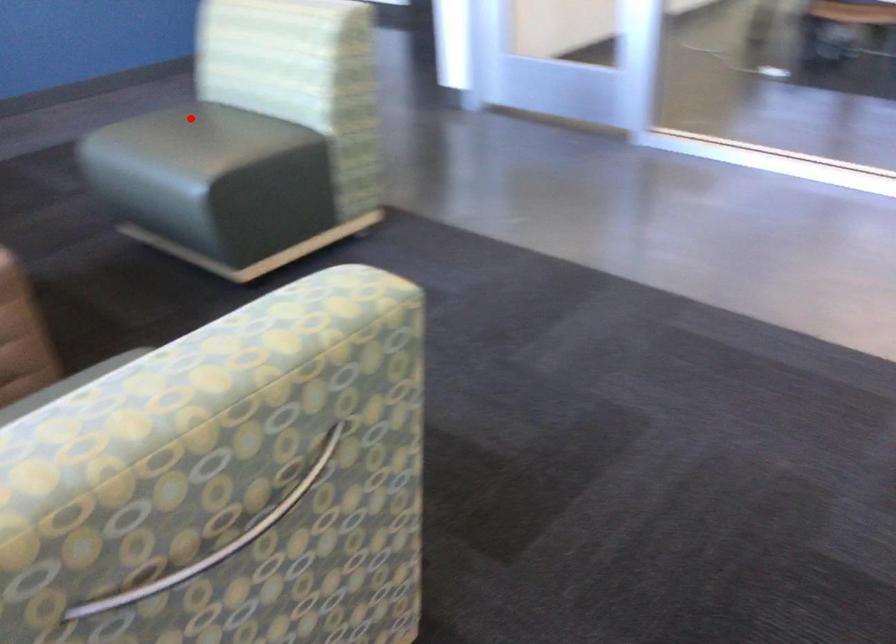
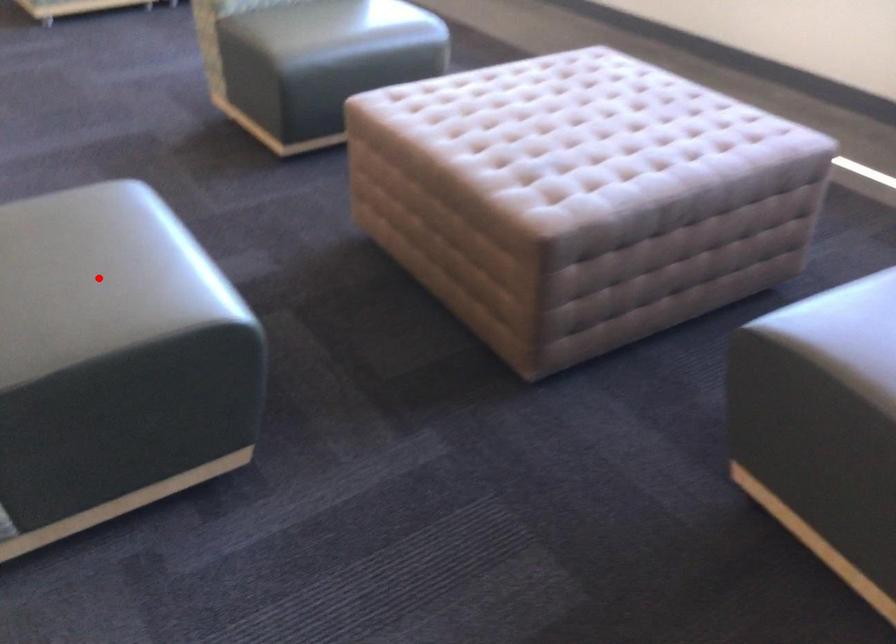
I am providing you with two images of the same scene from different viewpoints. A red point is marked on the first image and another point is marked on the second image. Is the red point in image1 aligned with the point shown in image2?

Yes